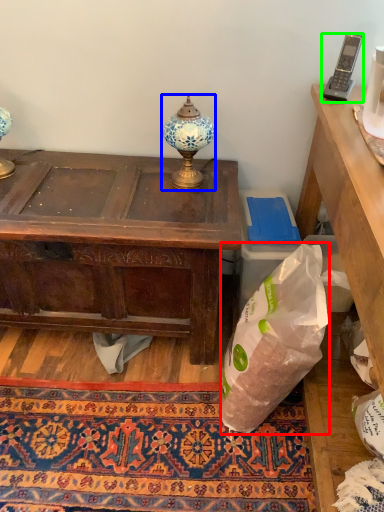
Question: Estimate the real-world distances between objects in this image. Which object is farther from plastic bag (highlighted by a red box), lamp (highlighted by a blue box) or corded phone (highlighted by a green box)?

Choices:
 (A) lamp
 (B) corded phone

Answer: (B)